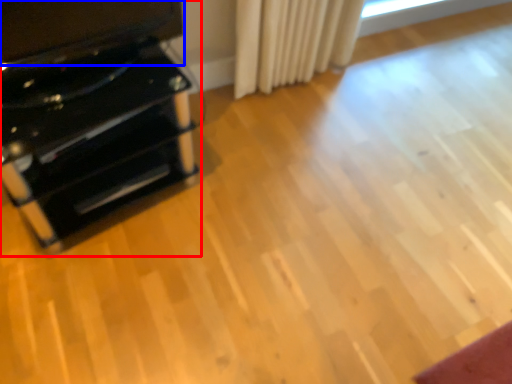
Question: Which object appears farthest to the camera in this image, furniture (highlighted by a red box) or wide (highlighted by a blue box)?

Choices:
 (A) furniture
 (B) wide

Answer: (A)